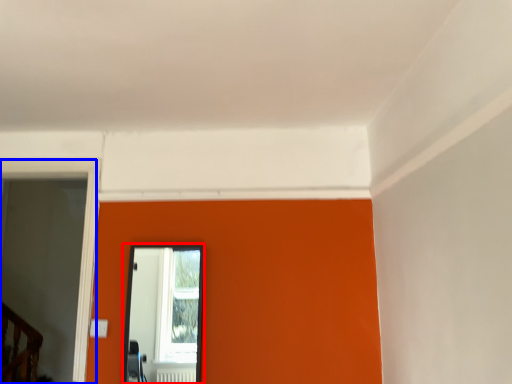
Question: Which of the following is the farthest to the observer, mirror (highlighted by a red box) or glass door (highlighted by a blue box)?

Choices:
 (A) mirror
 (B) glass door

Answer: (A)